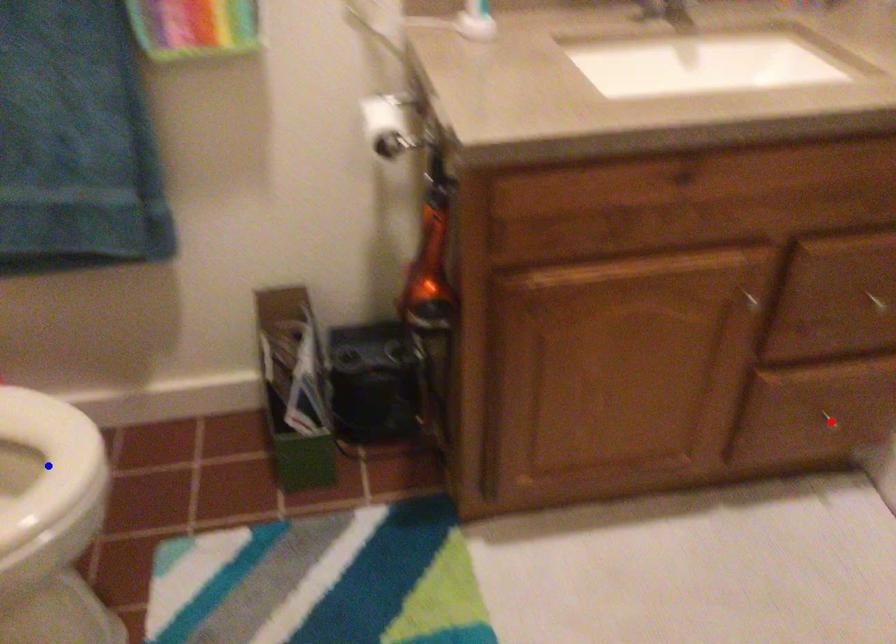
Question: Two points are marked on the image. Which point is closer to the camera?

Choices:
 (A) Blue point is closer.
 (B) Red point is closer.

Answer: (A)